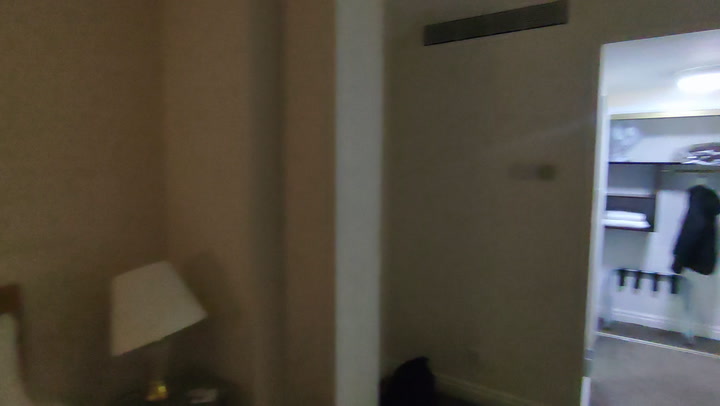
Locate an element on the screen. Image resolution: width=720 pixels, height=406 pixels. wooden headboard is located at coordinates (9, 294).